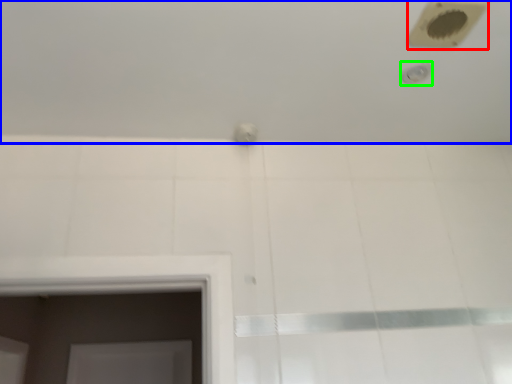
Question: Which object is positioned closest to hole (highlighted by a red box)? Select from bath (highlighted by a blue box) and shower (highlighted by a green box).

Choices:
 (A) bath
 (B) shower

Answer: (B)